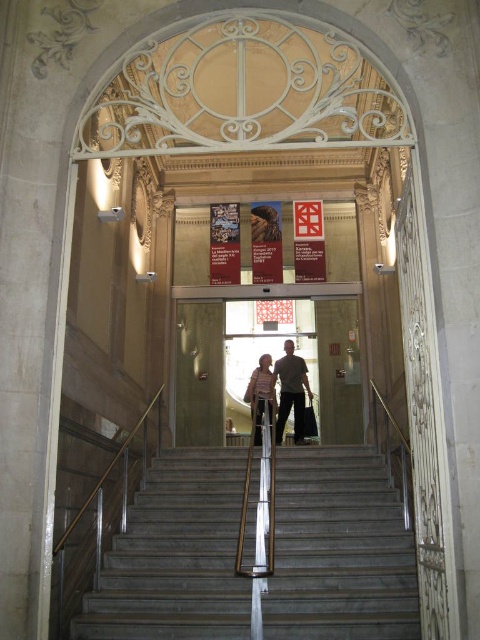
Question: Based on their relative distances, which object is farther from the light brown leather shoes at center?

Choices:
 (A) matte beige dress at center
 (B) wooden door at center

Answer: (B)

Question: Which object is closer to the camera taking this photo?

Choices:
 (A) smooth gray stairs at center
 (B) matte beige dress at center
 (C) wooden door at center
 (D) light brown leather shoes at center

Answer: (A)

Question: Does wooden door at center appear under matte beige dress at center?

Choices:
 (A) yes
 (B) no

Answer: (B)

Question: Can you confirm if wooden door at center is positioned to the left of matte beige dress at center?

Choices:
 (A) yes
 (B) no

Answer: (B)

Question: Is smooth gray stairs at center thinner than light brown leather shoes at center?

Choices:
 (A) no
 (B) yes

Answer: (A)

Question: Which object is the farthest from the light brown leather shoes at center?

Choices:
 (A) wooden door at center
 (B) smooth gray stairs at center

Answer: (B)